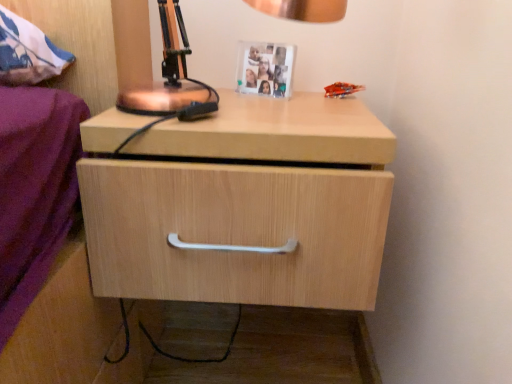
The width and height of the screenshot is (512, 384). Find the location of `vacant space in front of white plastic picture frame at upper center`. vacant space in front of white plastic picture frame at upper center is located at coordinates (252, 111).